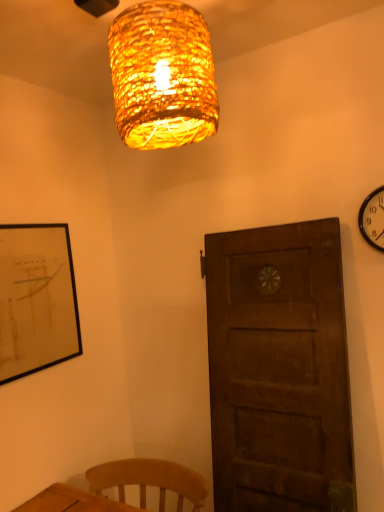
Question: Relative to woven bamboo lampshade at upper center, is black metal wall clock at upper right in front or behind?

Choices:
 (A) front
 (B) behind

Answer: (B)

Question: Is point (369, 232) closer or farther from the camera than point (175, 142)?

Choices:
 (A) closer
 (B) farther

Answer: (B)

Question: Would you say black metal wall clock at upper right is to the left or to the right of woven bamboo lampshade at upper center in the picture?

Choices:
 (A) right
 (B) left

Answer: (A)

Question: Based on their sizes in the image, would you say woven bamboo lampshade at upper center is bigger or smaller than black metal wall clock at upper right?

Choices:
 (A) small
 (B) big

Answer: (B)

Question: Considering the positions of woven bamboo lampshade at upper center and black metal wall clock at upper right in the image, is woven bamboo lampshade at upper center wider or thinner than black metal wall clock at upper right?

Choices:
 (A) wide
 (B) thin

Answer: (A)

Question: From a real-world perspective, relative to black metal wall clock at upper right, is woven bamboo lampshade at upper center vertically above or below?

Choices:
 (A) above
 (B) below

Answer: (A)

Question: In the image, is woven bamboo lampshade at upper center positioned in front of or behind black metal wall clock at upper right?

Choices:
 (A) front
 (B) behind

Answer: (A)